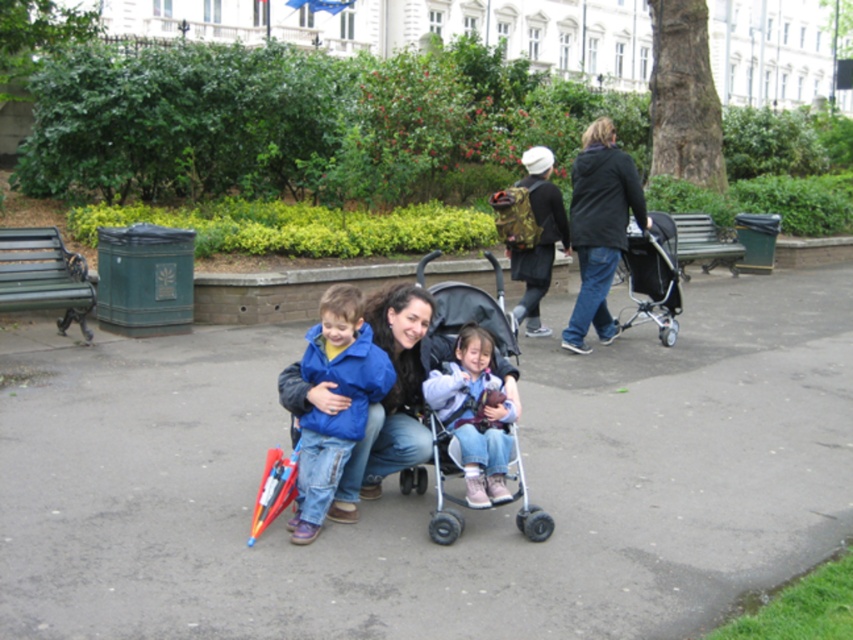
You are a delivery person with a cart that is 12 feet wide. You need to navigate between the pink suede boots at center and the black textured stroller at center right in the park scene. Can your cart fit through the space between them?

The pink suede boots at center and black textured stroller at center right are 14.17 feet apart, so yes, the cart can fit through the space between them since it is wider than the cart.

You are a photographer trying to capture a clear shot of the pink suede boots at center and the black textured stroller at center. Since the stroller is in the way, will you need to move it to get a good view of the boots?

The pink suede boots at center is positioned under the black textured stroller at center, so you will need to move the black textured stroller at center to get a clear view of the pink suede boots at center.

Looking at this image, you are a photographer setting up a tripod in the park. You need to place the tripod so that it doesn not block the view of the pink suede boots at center and the black textured stroller at center right. Given that the tripod has a base diameter of 30 cm, can you fit it between them without overlapping either object?

The pink suede boots at center has a smaller size compared to black textured stroller at center right. Since the tripod requires a 30 cm space, you need to ensure there is enough space between them. However, without knowing the exact distance between the two objects, it is impossible to determine if the tripod can fit. Please check the actual distance between the pink suede boots at center and the black textured stroller at center right.